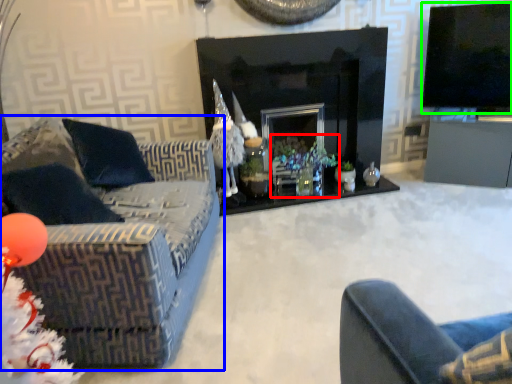
Question: Based on their relative distances, which object is nearer to christmas decoration (highlighted by a red box)? Choose from studio couch (highlighted by a blue box) and television (highlighted by a green box).

Choices:
 (A) studio couch
 (B) television

Answer: (A)